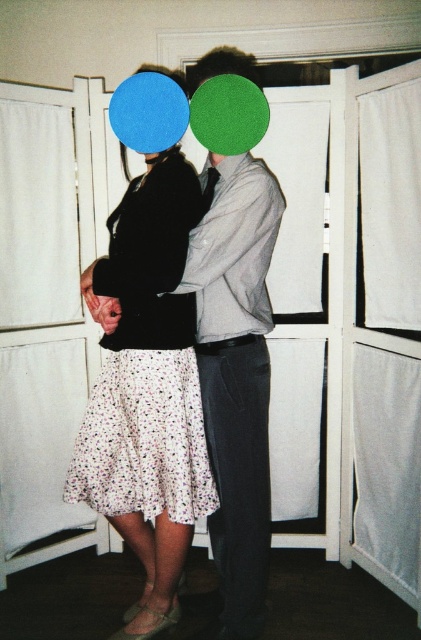
Question: Does white floral skirt at lower left appear over matte green hair at center?

Choices:
 (A) no
 (B) yes

Answer: (A)

Question: Which point is closer to the camera?

Choices:
 (A) (208, 61)
 (B) (100, 288)
 (C) (178, 100)

Answer: (B)

Question: Among these objects, which one is nearest to the camera?

Choices:
 (A) matte green hair at center
 (B) floral cotton dress at center

Answer: (B)

Question: Which of these objects is positioned closest to the matte green hair at center?

Choices:
 (A) floral cotton dress at center
 (B) white floral skirt at lower left

Answer: (B)

Question: Does floral cotton dress at center appear under matte green hair at center?

Choices:
 (A) no
 (B) yes

Answer: (B)

Question: Does white floral skirt at lower left appear on the right side of matte green hair at center?

Choices:
 (A) yes
 (B) no

Answer: (B)